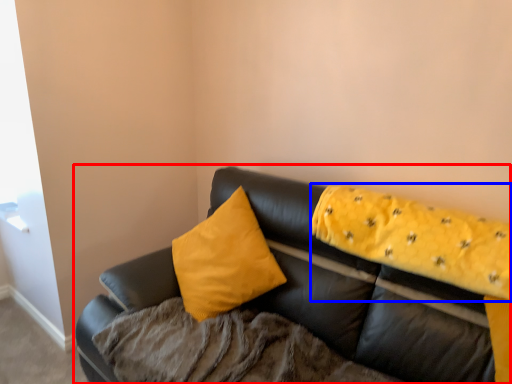
Question: Among these objects, which one is farthest to the camera, studio couch (highlighted by a red box) or blanket (highlighted by a blue box)?

Choices:
 (A) studio couch
 (B) blanket

Answer: (B)